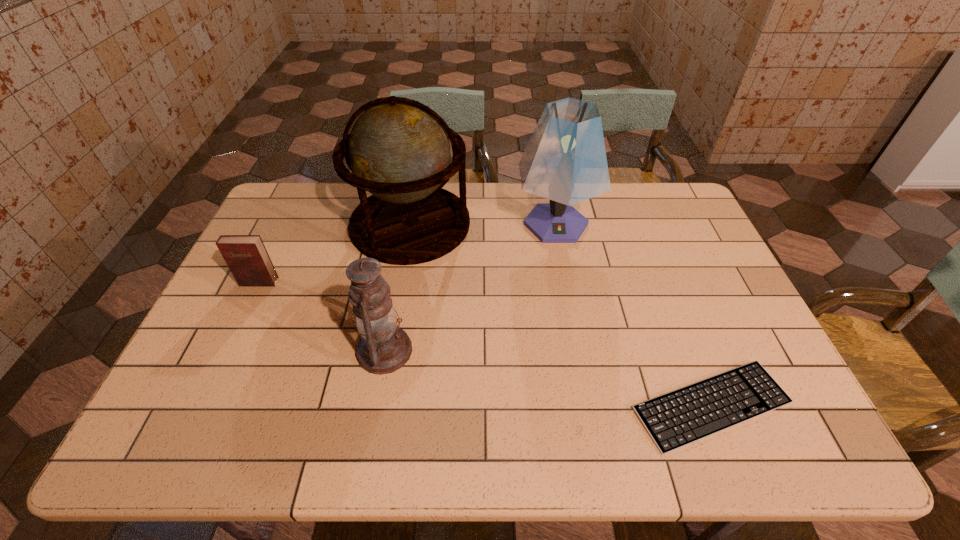
Where is `blank space at the right edge`? blank space at the right edge is located at coordinates (690, 225).

Find the location of a particular element. The image size is (960, 540). free space at the far right corner is located at coordinates (689, 219).

Locate an element on the screen. The height and width of the screenshot is (540, 960). vacant point located between the oil lamp and the lampshade is located at coordinates (470, 287).

Where is `free space between the globe and the lampshade`? free space between the globe and the lampshade is located at coordinates coord(483,224).

You are a GUI agent. You are given a task and a screenshot of the screen. Output one action in this format:
    pyautogui.click(x=<x>, y=<y>)
    Task: Click on the empty space that is in between the third nearest object and the globe
    
    Given the screenshot: What is the action you would take?
    pyautogui.click(x=335, y=253)

The image size is (960, 540). In order to click on free space between the lampshade and the oil lamp in this screenshot , I will do `click(470, 287)`.

Locate an element on the screen. blank region between the second shortest object and the globe is located at coordinates (335, 253).

Find the location of a particular element. The image size is (960, 540). unoccupied area between the lampshade and the oil lamp is located at coordinates (470, 287).

I want to click on free point between the globe and the lampshade, so click(483, 224).

Find the location of a particular element. empty space between the third shortest object and the computer keyboard is located at coordinates (548, 378).